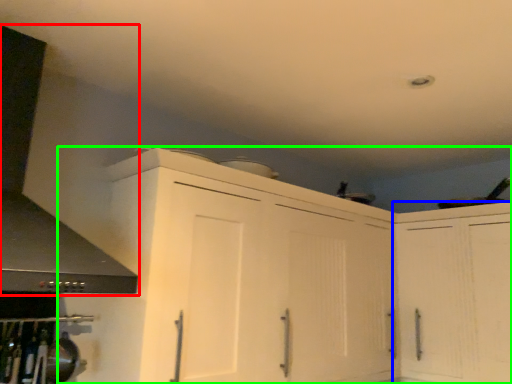
Question: Estimate the real-world distances between objects in this image. Which object is closer to exhaust hood (highlighted by a red box), cabinetry (highlighted by a blue box) or cabinetry (highlighted by a green box)?

Choices:
 (A) cabinetry
 (B) cabinetry

Answer: (B)